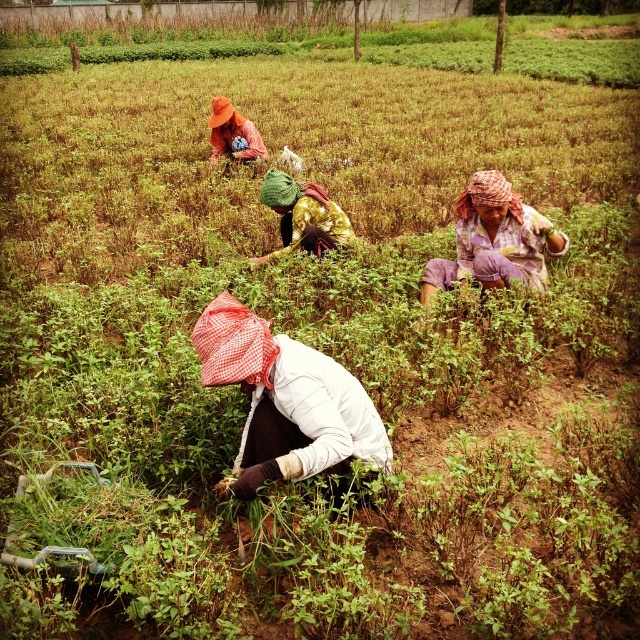
Question: Is white cotton shirt at center smaller than green fabric headscarf at center?

Choices:
 (A) yes
 (B) no

Answer: (A)

Question: Which object is positioned closest to the orange fabric hat at upper center?

Choices:
 (A) white cotton shirt at center
 (B) plaid fabric headscarf at center

Answer: (B)

Question: Does plaid fabric headscarf at center appear over green fabric headscarf at center?

Choices:
 (A) yes
 (B) no

Answer: (B)

Question: Is white cotton shirt at center below plaid fabric headscarf at center?

Choices:
 (A) yes
 (B) no

Answer: (A)

Question: Based on their relative distances, which object is nearer to the green fabric headscarf at center?

Choices:
 (A) white cotton shirt at center
 (B) orange fabric hat at upper center

Answer: (A)

Question: Which point is farther from the camera taking this photo?

Choices:
 (A) (284, 209)
 (B) (522, 227)

Answer: (A)